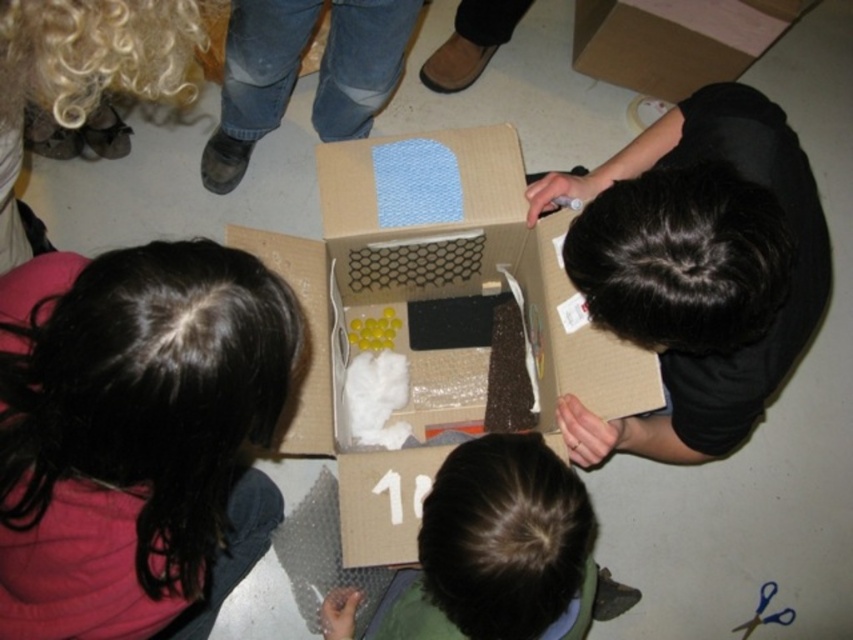
You are an assembly worker handling the items in the open cardboard box. You need to retrieve the brown fuzzy hair at lower center. Is the black matte shirt at upper right blocking your access to it?

The black matte shirt at upper right is positioned over brown fuzzy hair at lower center, so yes, the black matte shirt at upper right is blocking access to the brown fuzzy hair at lower center.

You are a delivery person who just arrived at a customer doorstep. You have a package that contains the cardboard box at center and the brown fuzzy hair at lower center. The customer wants to know if both items can fit on their 12 inch wide shelf. Can you confirm?

The distance between the cardboard box at center and the brown fuzzy hair at lower center is 11.75 inches, so yes, both items can fit on the 12 inch wide shelf since the total width required is less than 12 inches.